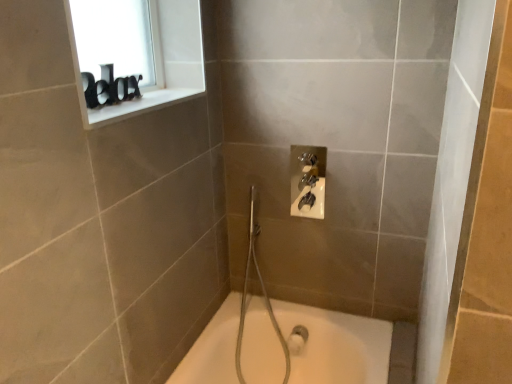
Question: Looking at their shapes, would you say white ceramic at upper left is wider or thinner than black plastic letters at upper left?

Choices:
 (A) thin
 (B) wide

Answer: (B)

Question: Is white ceramic at upper left taller or shorter than black plastic letters at upper left?

Choices:
 (A) tall
 (B) short

Answer: (B)

Question: Is point (178, 99) closer or farther from the camera than point (115, 21)?

Choices:
 (A) farther
 (B) closer

Answer: (A)

Question: In terms of height, does black plastic letters at upper left look taller or shorter compared to white ceramic at upper left?

Choices:
 (A) short
 (B) tall

Answer: (B)

Question: From the image's perspective, relative to white ceramic at upper left, is black plastic letters at upper left above or below?

Choices:
 (A) above
 (B) below

Answer: (A)

Question: Looking at their shapes, would you say black plastic letters at upper left is wider or thinner than white ceramic at upper left?

Choices:
 (A) wide
 (B) thin

Answer: (B)

Question: Is black plastic letters at upper left situated inside white ceramic at upper left or outside?

Choices:
 (A) outside
 (B) inside

Answer: (A)